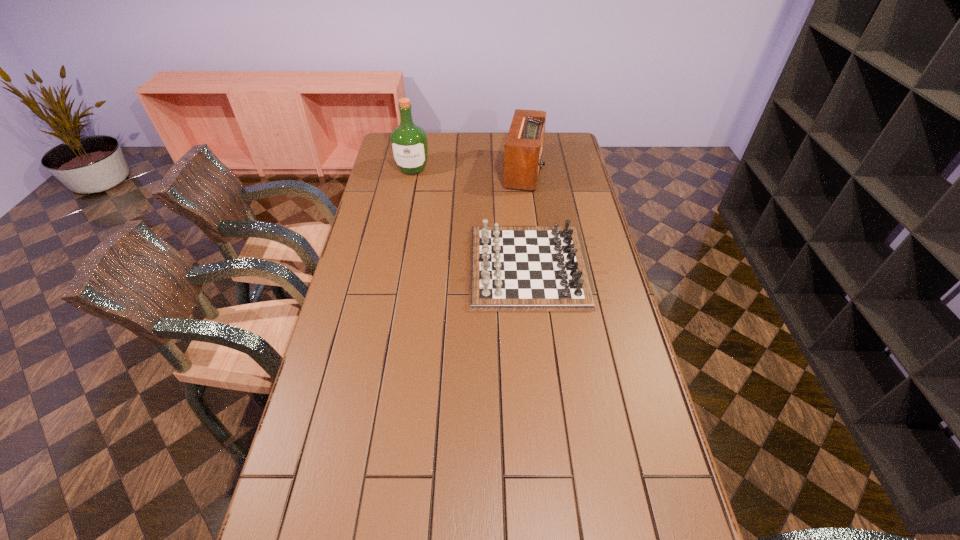
Find the location of `liquor`. liquor is located at coordinates (409, 145).

Find the location of a particular element. Image resolution: width=960 pixels, height=540 pixels. the leftmost object is located at coordinates (409, 145).

The width and height of the screenshot is (960, 540). In order to click on radio receiver in this screenshot , I will do `click(523, 150)`.

Identify the location of chessboard. (512, 268).

Identify the location of the nearest object. The height and width of the screenshot is (540, 960). (512, 268).

Find the location of a particular element. vacant space situated 0.090m on the front-facing side of the tallest object is located at coordinates (408, 191).

This screenshot has width=960, height=540. Find the location of `blank area located on the back of the radio receiver`. blank area located on the back of the radio receiver is located at coordinates (519, 142).

Identify the location of free space located from the player's perspective of the chessboard. (446, 267).

Locate an element on the screen. This screenshot has height=540, width=960. blank area located from the player's perspective of the chessboard is located at coordinates (397, 267).

This screenshot has width=960, height=540. In order to click on vacant space located from the player's perspective of the chessboard in this screenshot , I will do `click(420, 267)`.